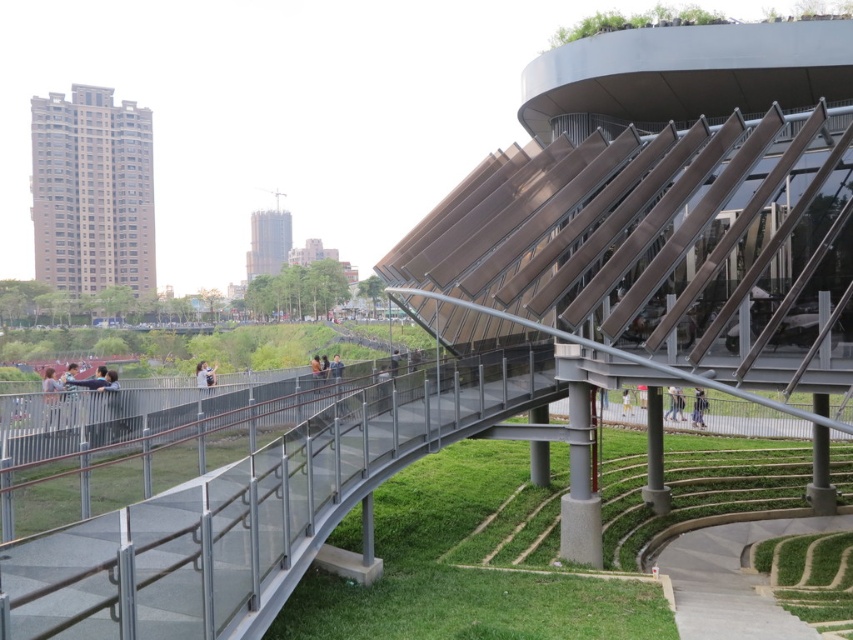
Question: Which object is positioned farthest from the light brown leather jacket at center?

Choices:
 (A) green grass at lower right
 (B) smooth glass skyscraper at upper center

Answer: (B)

Question: Estimate the real-world distances between objects in this image. Which object is farther from the green grass at center?

Choices:
 (A) brown concrete building at left
 (B) green grass at lower right

Answer: (A)

Question: Is brown concrete building at left bigger than light brown leather jacket at center?

Choices:
 (A) no
 (B) yes

Answer: (B)

Question: Which of these objects is positioned closest to the brown concrete building at left?

Choices:
 (A) green grass at center
 (B) green grass at lower right
 (C) light brown leather jacket at center
 (D) smooth glass skyscraper at upper center

Answer: (D)

Question: Does smooth glass skyscraper at upper center have a larger size compared to light brown leather jacket at center?

Choices:
 (A) no
 (B) yes

Answer: (A)

Question: Can you confirm if green grass at lower right is bigger than smooth glass skyscraper at upper center?

Choices:
 (A) yes
 (B) no

Answer: (B)